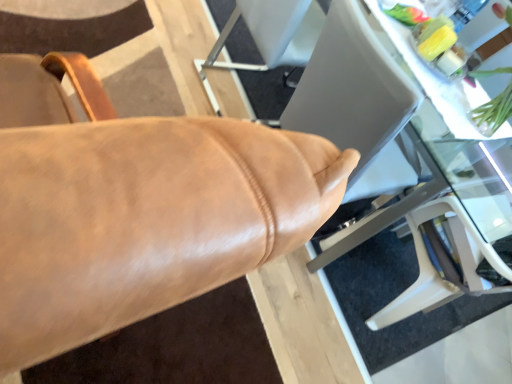
Question: Is green leafy plant at upper right positioned beyond the bounds of leather chair at center?

Choices:
 (A) yes
 (B) no

Answer: (A)

Question: Is green leafy plant at upper right not close to leather chair at center?

Choices:
 (A) yes
 (B) no

Answer: (A)

Question: Does green leafy plant at upper right appear on the left side of leather chair at center?

Choices:
 (A) yes
 (B) no

Answer: (B)

Question: Does green leafy plant at upper right touch leather chair at center?

Choices:
 (A) yes
 (B) no

Answer: (B)

Question: From a real-world perspective, is green leafy plant at upper right physically above leather chair at center?

Choices:
 (A) yes
 (B) no

Answer: (A)

Question: From a real-world perspective, is green leafy plant at upper right located beneath leather chair at center?

Choices:
 (A) no
 (B) yes

Answer: (A)

Question: Is leather chair at center with transparent glass table at center?

Choices:
 (A) no
 (B) yes

Answer: (A)

Question: Can you confirm if leather chair at center is shorter than transparent glass table at center?

Choices:
 (A) yes
 (B) no

Answer: (B)

Question: From a real-world perspective, is leather chair at center positioned under transparent glass table at center based on gravity?

Choices:
 (A) yes
 (B) no

Answer: (B)

Question: Is leather chair at center positioned before transparent glass table at center?

Choices:
 (A) yes
 (B) no

Answer: (A)

Question: Would you say leather chair at center is a long distance from transparent glass table at center?

Choices:
 (A) no
 (B) yes

Answer: (B)

Question: Is leather chair at center smaller than transparent glass table at center?

Choices:
 (A) no
 (B) yes

Answer: (B)

Question: From a real-world perspective, is transparent glass table at center on top of green leafy plant at upper right?

Choices:
 (A) no
 (B) yes

Answer: (A)